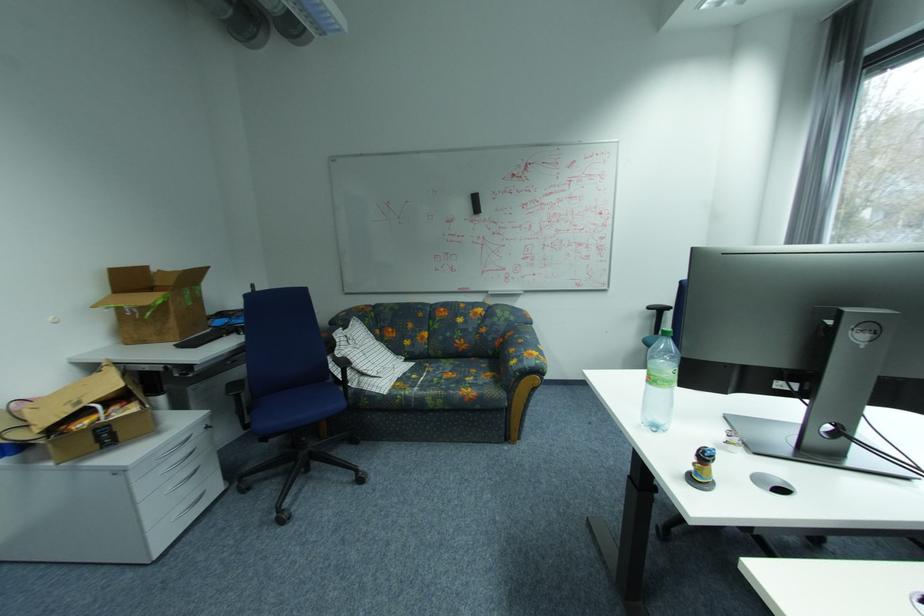
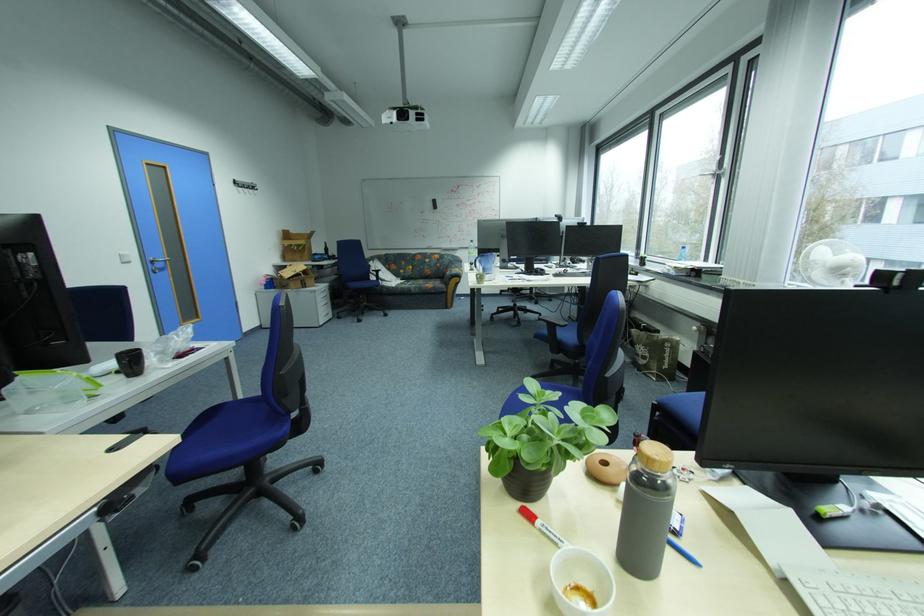
The point at (520, 320) is marked in the first image. Where is the corresponding point in the second image?

(460, 261)